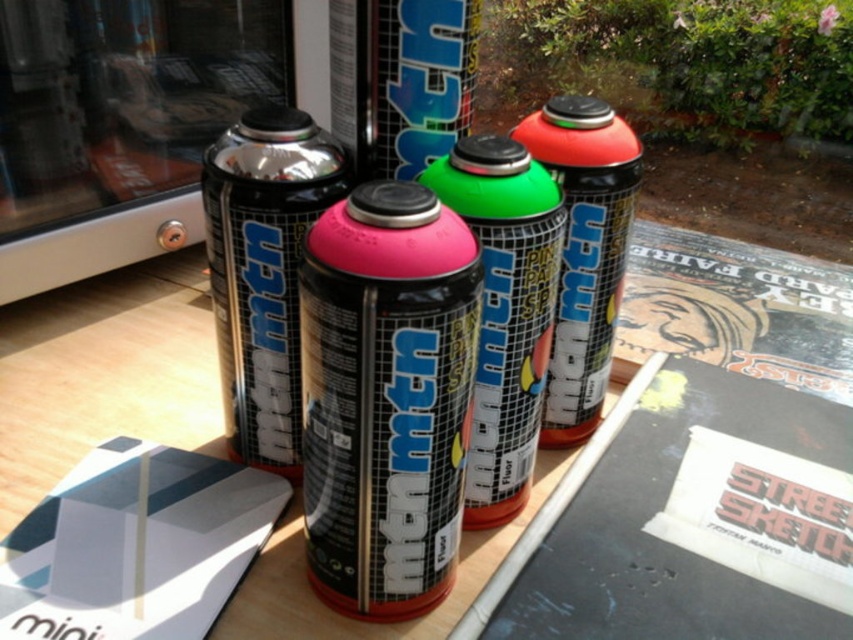
The image size is (853, 640). Describe the element at coordinates (386, 396) in the screenshot. I see `pink matte spray can at center` at that location.

Does pink matte spray can at center come behind metallic black spray can at center?

No, pink matte spray can at center is in front of metallic black spray can at center.

Does point (332, 333) lie in front of point (279, 172)?

Yes, it is in front of point (279, 172).

Find the location of a particular element. The width and height of the screenshot is (853, 640). pink matte spray can at center is located at coordinates (386, 396).

Can you confirm if pink matte spray can at center is wider than matte black spray can at center?

Yes, pink matte spray can at center is wider than matte black spray can at center.

In the scene shown: Who is lower down, pink matte spray can at center or matte black spray can at center?

Positioned lower is pink matte spray can at center.

In order to click on pink matte spray can at center in this screenshot , I will do `click(386, 396)`.

This screenshot has height=640, width=853. What are the coordinates of `pink matte spray can at center` in the screenshot? It's located at (x=386, y=396).

Is pink matte spray can at center shorter than green matte spray can at center?

Yes.

Can you confirm if pink matte spray can at center is positioned to the left of green matte spray can at center?

Indeed, pink matte spray can at center is positioned on the left side of green matte spray can at center.

Is point (366, 429) more distant than point (492, 404)?

No, (366, 429) is closer to viewer.

Where is `pink matte spray can at center`? The image size is (853, 640). pink matte spray can at center is located at coordinates (386, 396).